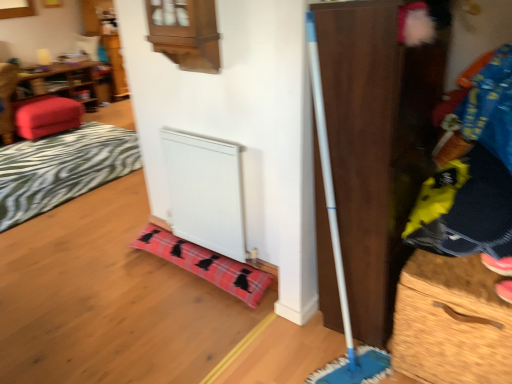
This screenshot has height=384, width=512. In order to click on free space to the left of pink suede shoe at lower right in this screenshot , I will do `click(462, 279)`.